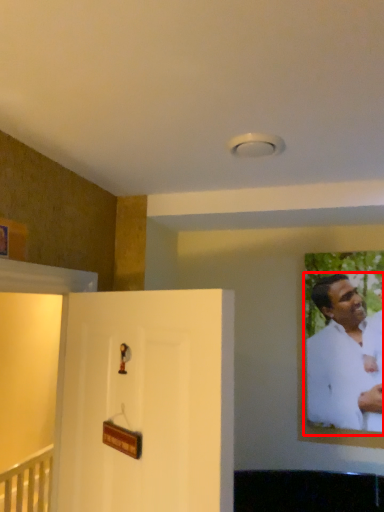
Question: In this image, where is man (annotated by the red box) located relative to door?

Choices:
 (A) right
 (B) left

Answer: (A)